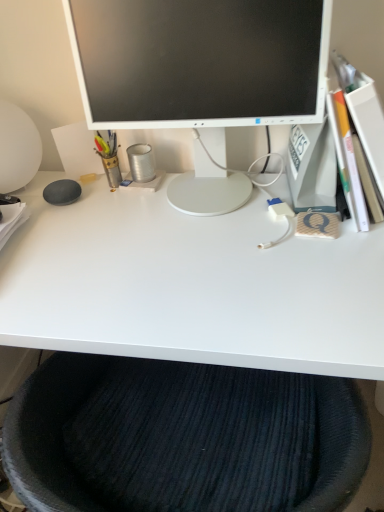
Where is `free location in front of metallic pen holder at left, which is the first stationery from left to right`? This screenshot has width=384, height=512. free location in front of metallic pen holder at left, which is the first stationery from left to right is located at coordinates (102, 212).